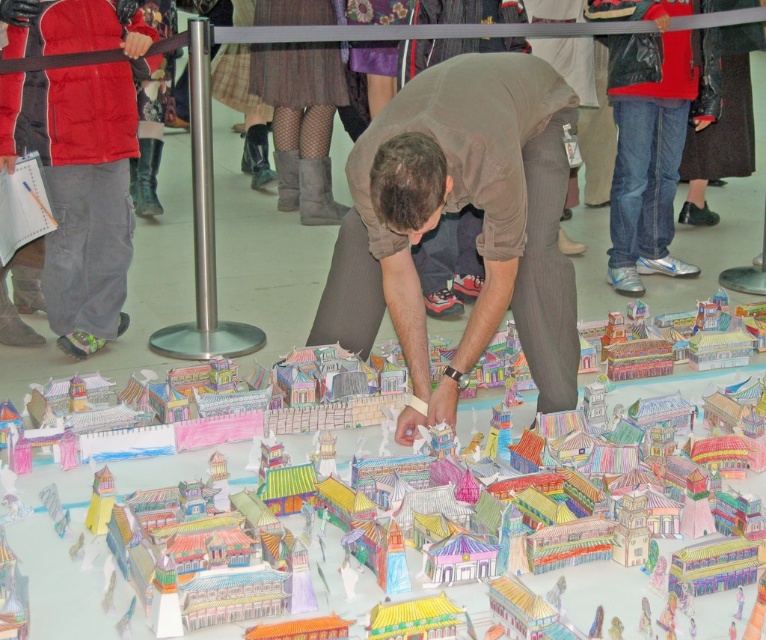
Question: Which point is farther from the camera taking this photo?

Choices:
 (A) (128, 241)
 (B) (296, 452)

Answer: (A)

Question: Can you confirm if red jacket at left is positioned above colorful paper model at center?

Choices:
 (A) yes
 (B) no

Answer: (A)

Question: Observing the image, what is the correct spatial positioning of brown fabric squat at center in reference to colorful paper model at center?

Choices:
 (A) above
 (B) below

Answer: (A)

Question: Which of the following is the closest to the observer?

Choices:
 (A) (372, 289)
 (B) (97, 556)
 (C) (61, 193)

Answer: (B)

Question: Considering the real-world distances, which object is farthest from the colorful paper model at center?

Choices:
 (A) brown fabric squat at center
 (B) red jacket at left

Answer: (B)

Question: Is brown fabric squat at center further to the viewer compared to colorful paper model at center?

Choices:
 (A) yes
 (B) no

Answer: (A)